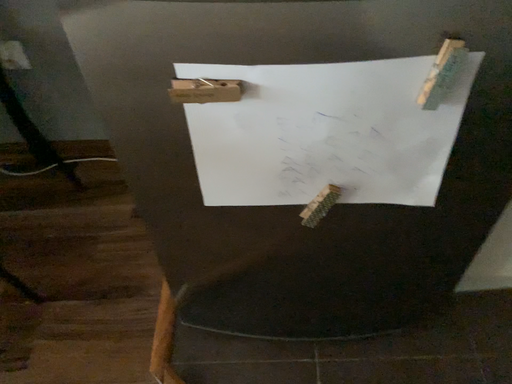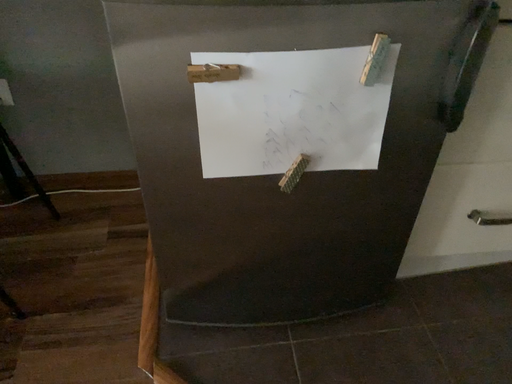
Question: How did the camera likely rotate when shooting the video?

Choices:
 (A) rotated left
 (B) rotated right

Answer: (B)